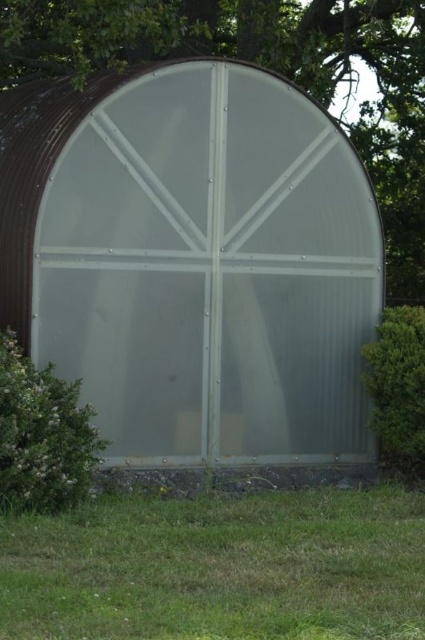
You are standing in the greenhouse and want to place a new plant stand. The clear plastic shed at center is in the way. Can you move the shed to the left to make space?

The clear plastic shed at center is located at point [195,268]. Since the question does not provide information about the shed being movable or its current position relative to other objects, I cannot determine if moving it to the left is possible. Please check the shed details for movability and space availability.

You are planning to place a new small garden bench in the greenhouse. The bench requires a space that is wider than the clear plastic shed at center. Is there enough space next to the green leafy hedge at right for the bench?

The clear plastic shed at center is larger than the green leafy hedge at right. Since the bench requires a space wider than the shed, there might not be enough space next to the hedge as it is smaller.